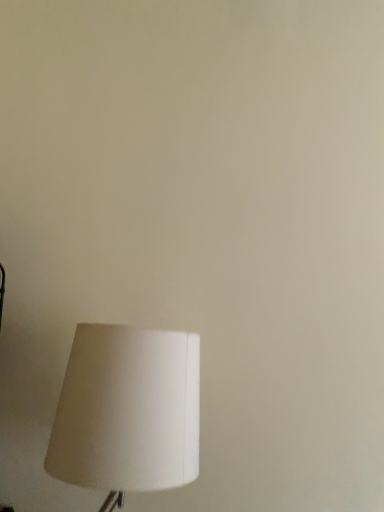
The width and height of the screenshot is (384, 512). What do you see at coordinates (128, 411) in the screenshot?
I see `white paper lampshade at lower left` at bounding box center [128, 411].

Measure the distance between point (x=198, y=403) and camera.

They are 4.07 feet apart.

The width and height of the screenshot is (384, 512). Find the location of `white paper lampshade at lower left`. white paper lampshade at lower left is located at coordinates (128, 411).

I want to click on white paper lampshade at lower left, so click(128, 411).